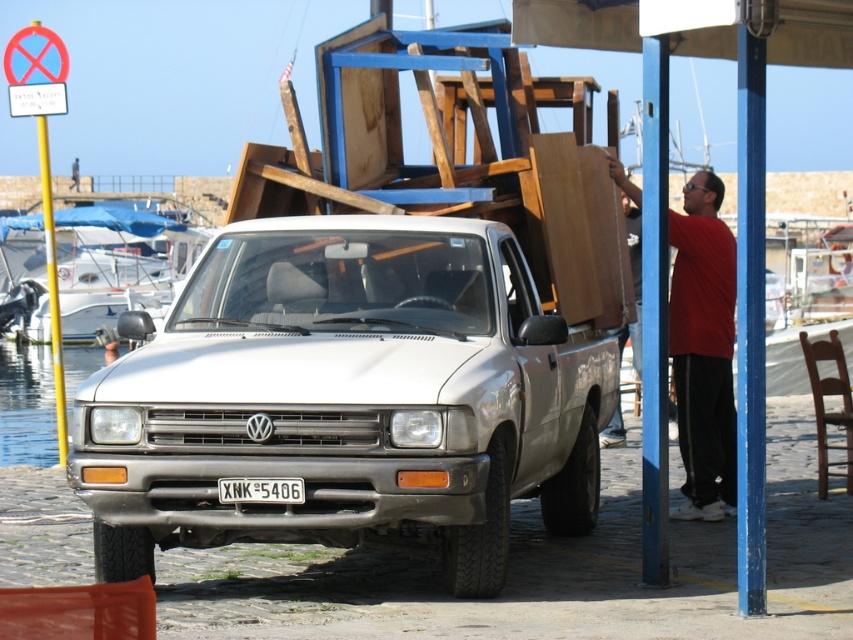
Question: Which of the following is the closest to the observer?

Choices:
 (A) (293, 483)
 (B) (636, 292)
 (C) (699, 180)

Answer: (A)

Question: Can you confirm if red cotton shirt at right is thinner than smooth brown wood at right?

Choices:
 (A) yes
 (B) no

Answer: (B)

Question: Can you confirm if clear water at lower left is wider than white plastic license plate at center?

Choices:
 (A) no
 (B) yes

Answer: (B)

Question: Considering the real-world distances, which object is farthest from the white plastic license plate at center?

Choices:
 (A) clear water at lower left
 (B) white matte truck at center
 (C) red cotton shirt at right
 (D) smooth brown wood at right

Answer: (A)

Question: Can you confirm if white matte truck at center is wider than smooth brown wood at right?

Choices:
 (A) no
 (B) yes

Answer: (B)

Question: Which of the following is the farthest from the observer?

Choices:
 (A) clear water at lower left
 (B) smooth brown wood at right

Answer: (A)